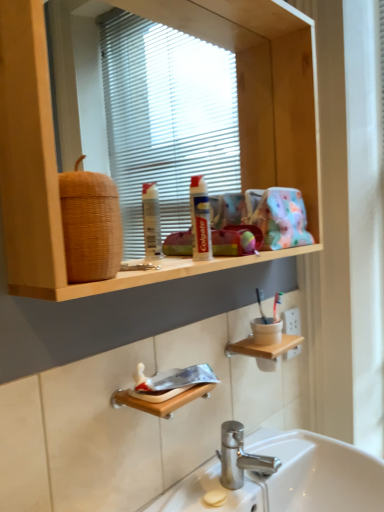
Question: Considering the relative sizes of white glossy sink at lower center and wooden shelf at lower center in the image provided, is white glossy sink at lower center bigger than wooden shelf at lower center?

Choices:
 (A) no
 (B) yes

Answer: (B)

Question: From the image's perspective, is white glossy sink at lower center over wooden shelf at lower center?

Choices:
 (A) yes
 (B) no

Answer: (B)

Question: Are white glossy sink at lower center and wooden shelf at lower center located far from each other?

Choices:
 (A) no
 (B) yes

Answer: (A)

Question: Is white glossy sink at lower center further to camera compared to wooden shelf at lower center?

Choices:
 (A) yes
 (B) no

Answer: (B)

Question: From the image's perspective, does white glossy sink at lower center appear lower than wooden shelf at lower center?

Choices:
 (A) yes
 (B) no

Answer: (A)

Question: Would you say wooden shelf at upper center is to the left or to the right of woven brown basket at upper left in the picture?

Choices:
 (A) right
 (B) left

Answer: (A)

Question: In terms of size, does wooden shelf at upper center appear bigger or smaller than woven brown basket at upper left?

Choices:
 (A) big
 (B) small

Answer: (A)

Question: From the image's perspective, is wooden shelf at upper center positioned above or below woven brown basket at upper left?

Choices:
 (A) below
 (B) above

Answer: (B)

Question: From a real-world perspective, is wooden shelf at upper center positioned above or below woven brown basket at upper left?

Choices:
 (A) above
 (B) below

Answer: (A)

Question: From the image's perspective, is white glossy sink at lower center positioned above or below wooden shelf at upper center?

Choices:
 (A) above
 (B) below

Answer: (B)

Question: Based on their positions, is white glossy sink at lower center located to the left or right of wooden shelf at upper center?

Choices:
 (A) left
 (B) right

Answer: (B)

Question: Does point (155, 509) appear closer or farther from the camera than point (276, 172)?

Choices:
 (A) closer
 (B) farther

Answer: (A)

Question: Is white glossy sink at lower center wider or thinner than wooden shelf at upper center?

Choices:
 (A) wide
 (B) thin

Answer: (A)

Question: From a real-world perspective, is wooden shelf at upper center positioned above or below wooden shelf at lower center?

Choices:
 (A) above
 (B) below

Answer: (A)

Question: Is wooden shelf at upper center bigger or smaller than wooden shelf at lower center?

Choices:
 (A) small
 (B) big

Answer: (B)